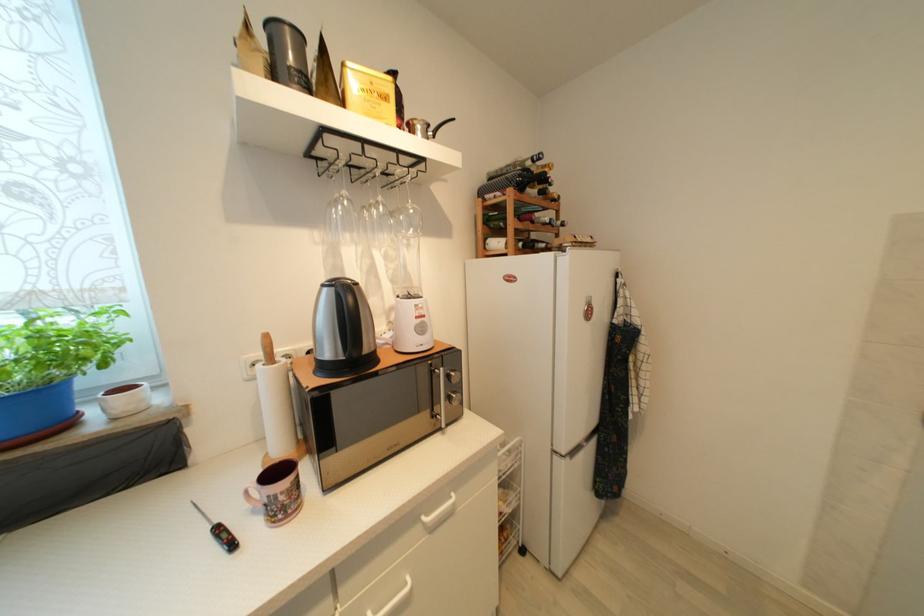
This screenshot has width=924, height=616. What do you see at coordinates (444, 392) in the screenshot?
I see `a microwave door handle` at bounding box center [444, 392].